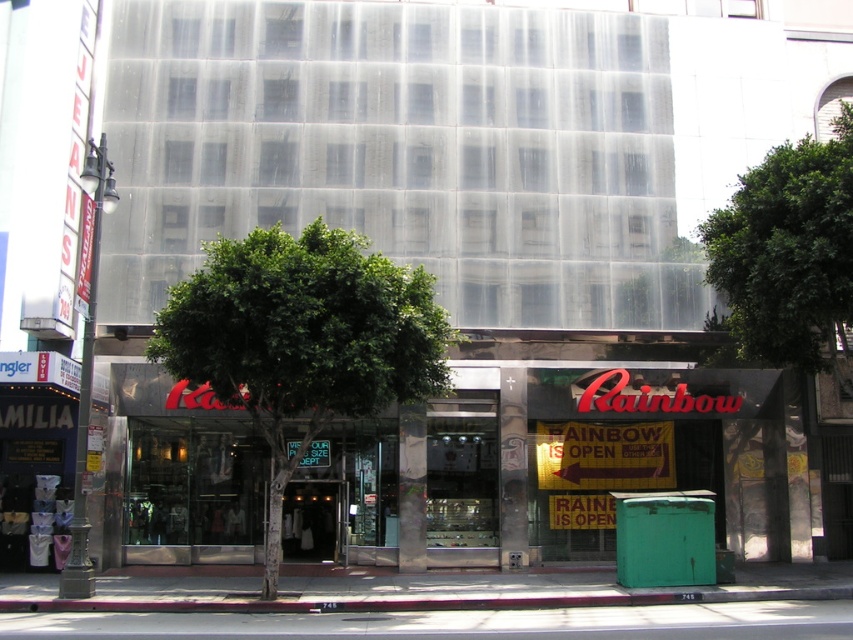
Is green leafy tree at center positioned in front of green leafy tree at upper right?

Yes, green leafy tree at center is in front of green leafy tree at upper right.

Locate an element on the screen. green leafy tree at center is located at coordinates (302, 340).

Locate an element on the screen. The image size is (853, 640). green leafy tree at center is located at coordinates (302, 340).

This screenshot has height=640, width=853. Find the location of `green leafy tree at center`. green leafy tree at center is located at coordinates (302, 340).